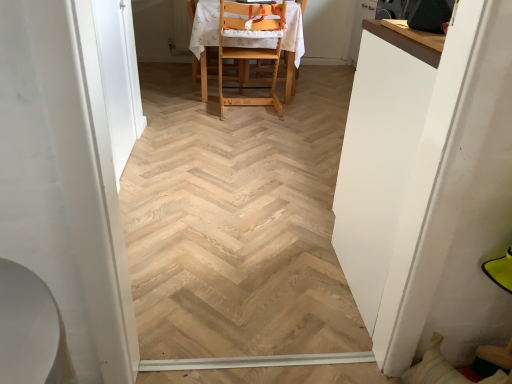
The height and width of the screenshot is (384, 512). I want to click on spots to the right of white glossy screen door at left, the second screen door positioned from the back, so click(190, 246).